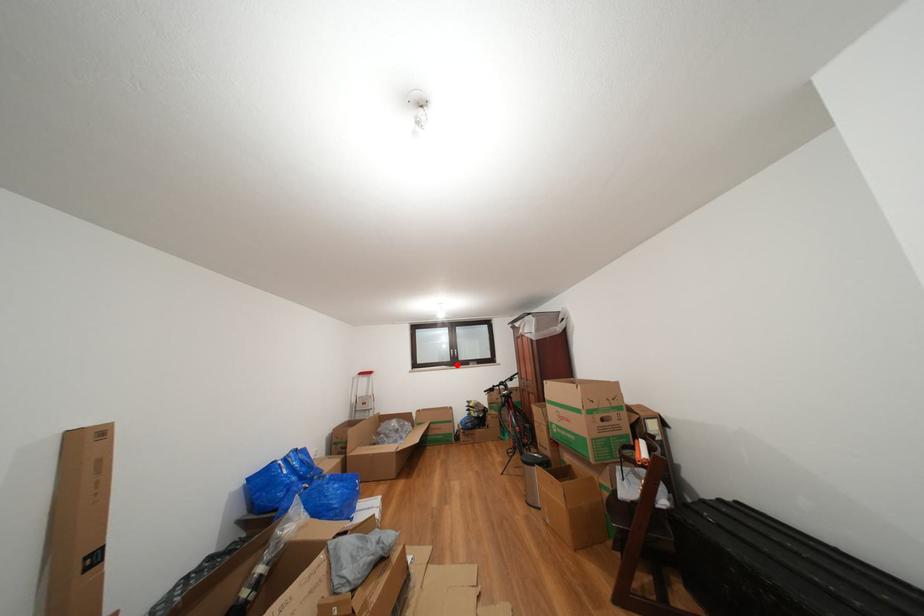
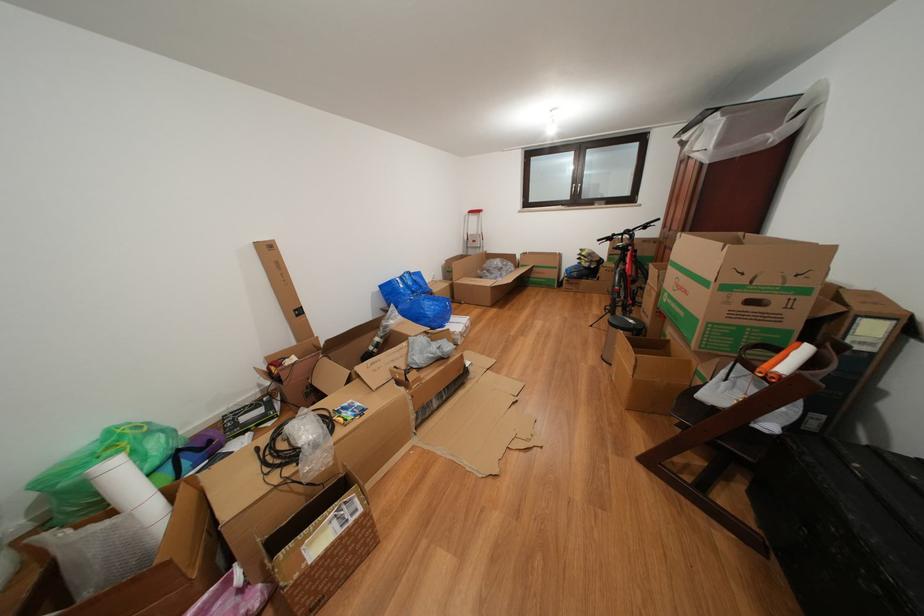
In the second image, find the point that corresponds to the highlighted location in the first image.

(576, 203)